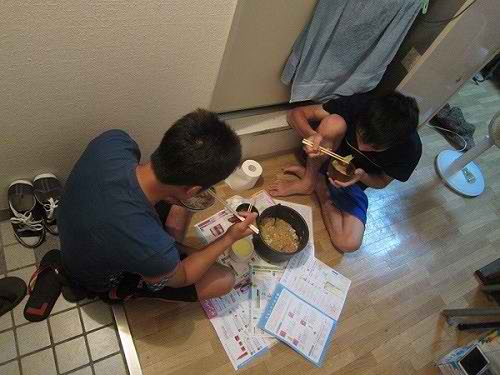
Where is `metal border between wood and tile`? The height and width of the screenshot is (375, 500). metal border between wood and tile is located at coordinates (130, 351).